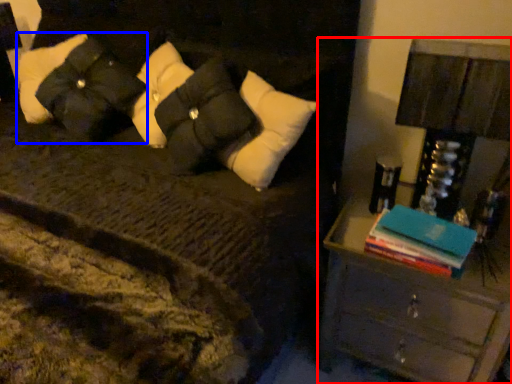
Question: Among these objects, which one is nearest to the camera, nightstand (highlighted by a red box) or pillow (highlighted by a blue box)?

Choices:
 (A) nightstand
 (B) pillow

Answer: (A)